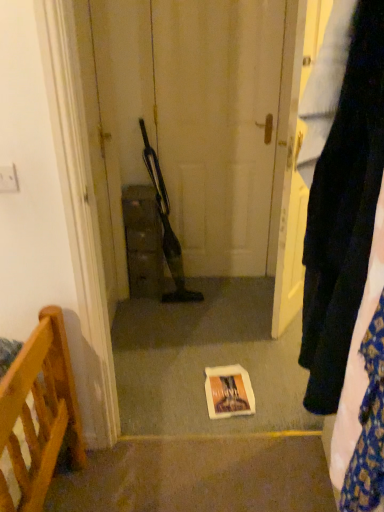
Question: From a real-world perspective, is matte brown cabinet at center over white paper bag at center?

Choices:
 (A) no
 (B) yes

Answer: (B)

Question: Is matte brown cabinet at center to the right of white paper bag at center from the viewer's perspective?

Choices:
 (A) yes
 (B) no

Answer: (B)

Question: Is matte brown cabinet at center completely or partially outside of white paper bag at center?

Choices:
 (A) no
 (B) yes

Answer: (B)

Question: Is matte brown cabinet at center taller than white paper bag at center?

Choices:
 (A) yes
 (B) no

Answer: (A)

Question: Is matte brown cabinet at center to the left of white paper bag at center from the viewer's perspective?

Choices:
 (A) no
 (B) yes

Answer: (B)

Question: In terms of width, does velvet dark blue pants at right look wider or thinner when compared to white paper bag at center?

Choices:
 (A) wide
 (B) thin

Answer: (B)

Question: From a real-world perspective, relative to white paper bag at center, is velvet dark blue pants at right vertically above or below?

Choices:
 (A) above
 (B) below

Answer: (A)

Question: Is velvet dark blue pants at right situated inside white paper bag at center or outside?

Choices:
 (A) outside
 (B) inside

Answer: (A)

Question: In terms of height, does velvet dark blue pants at right look taller or shorter compared to white paper bag at center?

Choices:
 (A) short
 (B) tall

Answer: (B)

Question: From their relative heights in the image, would you say velvet dark blue pants at right is taller or shorter than matte brown cabinet at center?

Choices:
 (A) short
 (B) tall

Answer: (B)

Question: Based on their positions, is velvet dark blue pants at right located to the left or right of matte brown cabinet at center?

Choices:
 (A) right
 (B) left

Answer: (A)

Question: Does point (327, 252) appear closer or farther from the camera than point (148, 268)?

Choices:
 (A) farther
 (B) closer

Answer: (B)

Question: Relative to matte brown cabinet at center, is velvet dark blue pants at right in front or behind?

Choices:
 (A) behind
 (B) front

Answer: (B)

Question: In terms of size, does matte brown cabinet at center appear bigger or smaller than velvet dark blue pants at right?

Choices:
 (A) small
 (B) big

Answer: (B)

Question: From a real-world perspective, relative to velvet dark blue pants at right, is matte brown cabinet at center vertically above or below?

Choices:
 (A) below
 (B) above

Answer: (A)